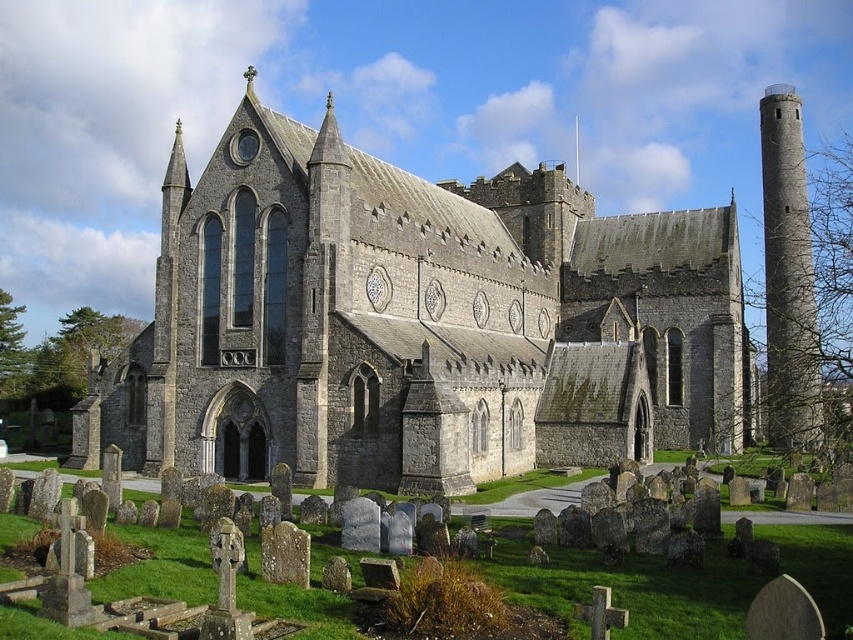
In the scene shown: You are a tourist standing in front of the gray stone church at center and the gray stone tower at right. Which structure appears smaller in the image?

The gray stone church at center appears smaller compared to the gray stone tower at right.

You are standing in front of the church and want to take a photo that includes both point (792, 435) and point (576, 147). Which point should you focus on first to ensure both are in focus?

Point (792, 435) is closer to the camera than point (576, 147). To ensure both are in focus, you should focus on point (792, 435) first.